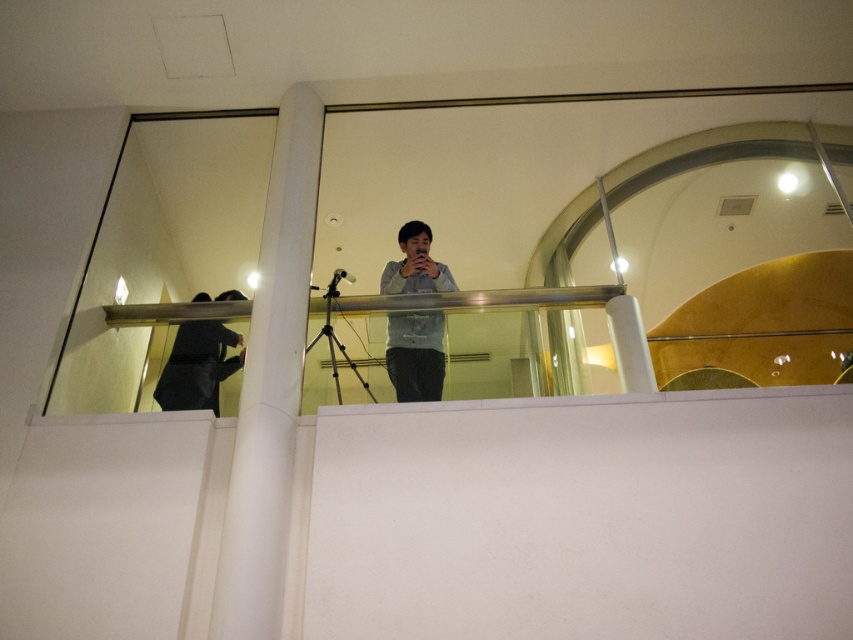
Question: Is light blue shirt at center positioned at the back of dark gray fabric at upper center?

Choices:
 (A) yes
 (B) no

Answer: (B)

Question: Among these points, which one is nearest to the camera?

Choices:
 (A) (332, 294)
 (B) (190, 400)

Answer: (A)

Question: Which point is closer to the camera taking this photo?

Choices:
 (A) (262, 422)
 (B) (190, 358)
 (C) (404, 275)
 (D) (328, 304)

Answer: (A)

Question: Is white smooth pillar at center below metallic tripod at center?

Choices:
 (A) yes
 (B) no

Answer: (B)

Question: Does white smooth pillar at center come in front of light blue shirt at center?

Choices:
 (A) no
 (B) yes

Answer: (B)

Question: Based on their relative distances, which object is nearer to the white smooth pillar at center?

Choices:
 (A) light blue shirt at center
 (B) metallic tripod at center
 (C) dark gray fabric at upper center

Answer: (B)